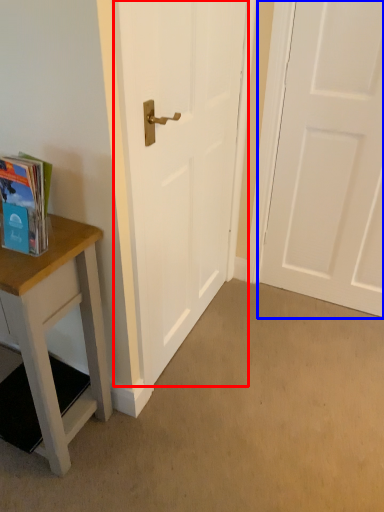
Question: Which object is closer to the camera taking this photo, door (highlighted by a red box) or door (highlighted by a blue box)?

Choices:
 (A) door
 (B) door

Answer: (A)